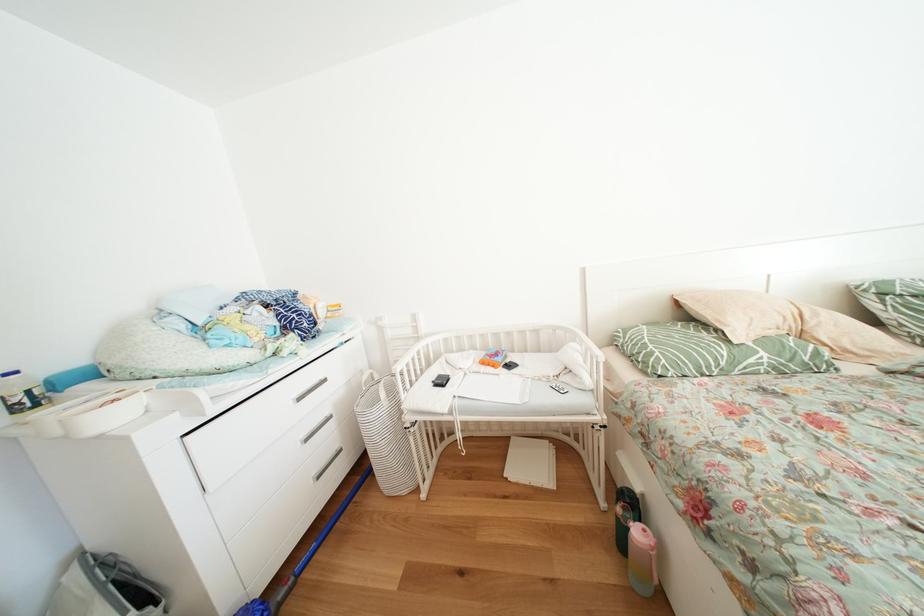
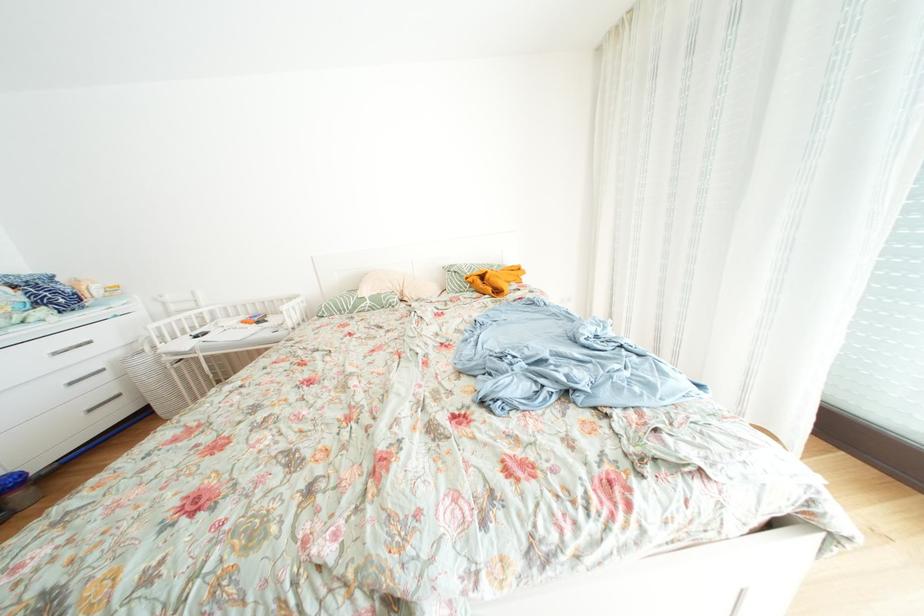
Locate, in the second image, the point that corresponds to (772,359) in the first image.

(378, 307)